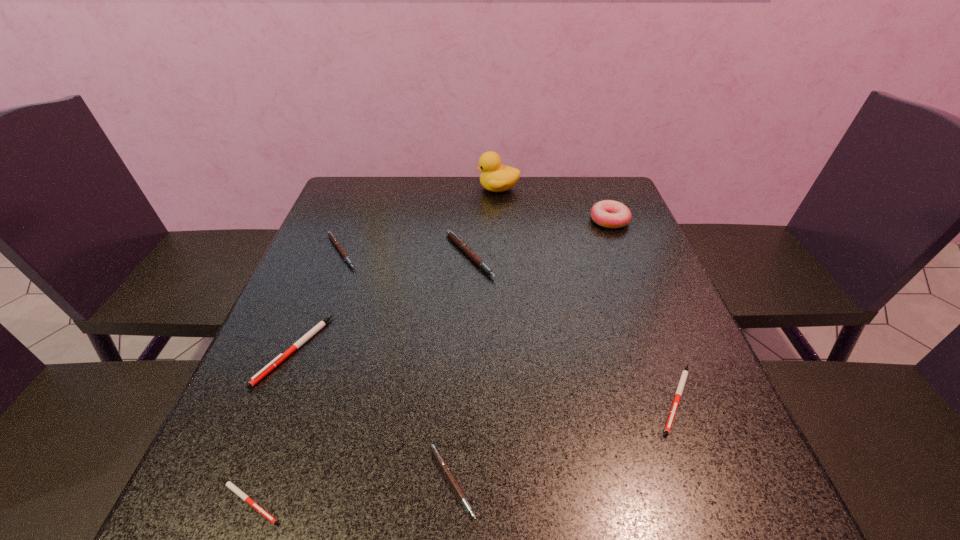
Identify the location of free space at the near edge. (427, 478).

Locate an element on the screen. The height and width of the screenshot is (540, 960). vacant space at the left edge of the desktop is located at coordinates [330, 226].

Locate an element on the screen. vacant region at the right edge is located at coordinates (644, 289).

The height and width of the screenshot is (540, 960). What are the coordinates of `empty location between the seventh nearest object and the smallest white pen` in the screenshot? It's located at (429, 361).

Find the location of a particular element. vacant region between the tallest object and the pink doughnut is located at coordinates (554, 204).

Locate an element on the screen. The height and width of the screenshot is (540, 960). free space between the biggest white pen and the shortest pen is located at coordinates (272, 426).

You are a GUI agent. You are given a task and a screenshot of the screen. Output one action in this format:
    pyautogui.click(x=<x>, y=<y>)
    Task: Click on the vacant area between the farthest object and the biggest pink pen
    The height and width of the screenshot is (540, 960).
    Given the screenshot: What is the action you would take?
    pyautogui.click(x=484, y=222)

You are a GUI agent. You are given a task and a screenshot of the screen. Output one action in this format:
    pyautogui.click(x=<x>, y=<y>)
    Task: Click on the vacant region between the biggest pink pen and the second farthest object
    The width and height of the screenshot is (960, 540).
    Given the screenshot: What is the action you would take?
    pyautogui.click(x=540, y=238)

Image resolution: width=960 pixels, height=540 pixels. Find the location of `free spot between the tallest object and the biggest pink pen`. free spot between the tallest object and the biggest pink pen is located at coordinates click(484, 222).

The width and height of the screenshot is (960, 540). In order to click on free spot between the leftmost pink pen and the doughnut in this screenshot , I will do `click(475, 236)`.